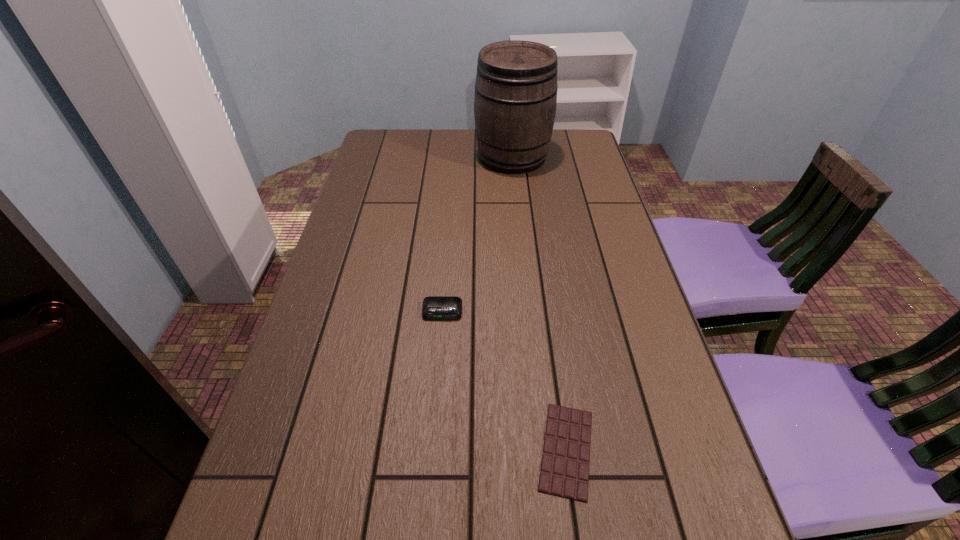
This screenshot has width=960, height=540. I want to click on the tallest object, so click(515, 99).

Where is `the farthest object`? The width and height of the screenshot is (960, 540). the farthest object is located at coordinates (515, 99).

This screenshot has width=960, height=540. Find the location of `the leftmost object`. the leftmost object is located at coordinates (434, 307).

Where is `the second farthest object`? The width and height of the screenshot is (960, 540). the second farthest object is located at coordinates (434, 307).

The height and width of the screenshot is (540, 960). I want to click on the nearest object, so click(564, 472).

The image size is (960, 540). In order to click on chocolate bar in this screenshot , I will do `click(564, 472)`.

You are a GUI agent. You are given a task and a screenshot of the screen. Output one action in this format:
    pyautogui.click(x=<x>, y=<y>)
    Task: Click on the vacant space located on the front of the farthest object
    The image size is (960, 540).
    Given the screenshot: What is the action you would take?
    pyautogui.click(x=518, y=214)

I want to click on free location located on the display of the second nearest object, so click(439, 357).

Identify the location of vacant space located 0.190m on the back of the shortest object. This screenshot has width=960, height=540. (549, 328).

Find the location of a particular element. This screenshot has width=960, height=540. object positioned at the far edge is located at coordinates (515, 99).